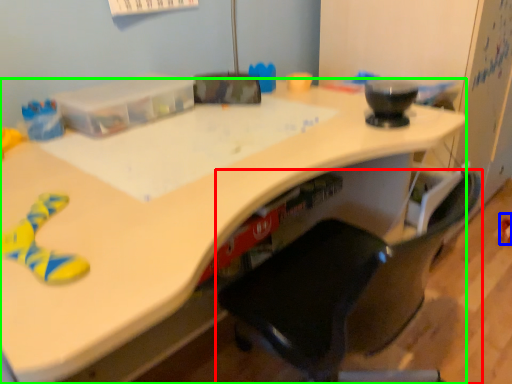
Question: Which is nearer to the chair (highlighted by a red box)? toy (highlighted by a blue box) or desk (highlighted by a green box).

Choices:
 (A) toy
 (B) desk

Answer: (B)